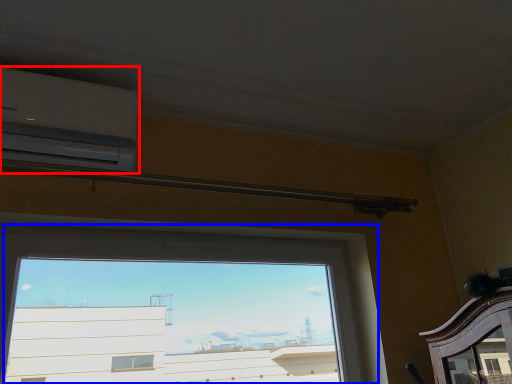
Question: Among these objects, which one is nearest to the camera, air conditioning (highlighted by a red box) or window (highlighted by a blue box)?

Choices:
 (A) air conditioning
 (B) window

Answer: (B)